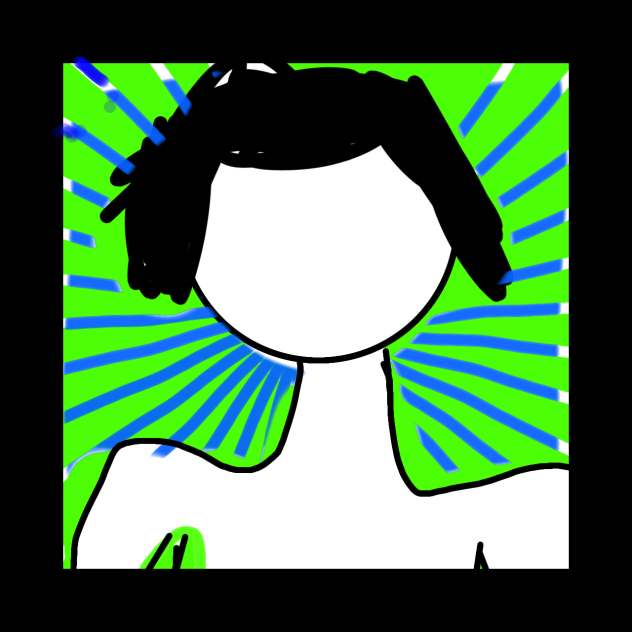
Locate an element on the screen. The height and width of the screenshot is (632, 632). chest is located at coordinates (337, 552).